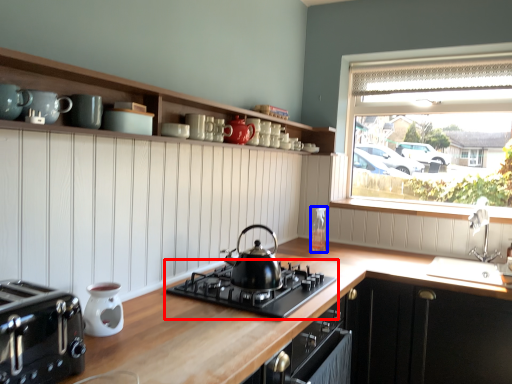
Question: Which of the following is the closest to the observer, gas stove (highlighted by a red box) or bottle (highlighted by a blue box)?

Choices:
 (A) gas stove
 (B) bottle

Answer: (A)